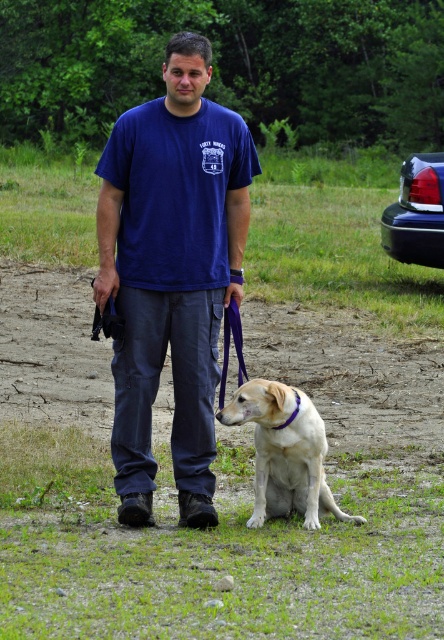
Question: Does blue cotton t-shirt at center have a larger size compared to light brown fur at center?

Choices:
 (A) yes
 (B) no

Answer: (A)

Question: Can you confirm if light brown fur at center is smaller than glossy plastic car at upper right?

Choices:
 (A) no
 (B) yes

Answer: (B)

Question: Which of these objects is positioned farthest from the light brown fur at center?

Choices:
 (A) glossy plastic car at upper right
 (B) blue cotton t-shirt at center

Answer: (A)

Question: Does light brown fur at center have a greater width compared to glossy plastic car at upper right?

Choices:
 (A) no
 (B) yes

Answer: (A)

Question: Which point is farther to the camera?

Choices:
 (A) blue cotton t-shirt at center
 (B) light brown fur at center

Answer: (B)

Question: Which point appears closest to the camera in this image?

Choices:
 (A) (131, 436)
 (B) (416, 227)

Answer: (A)